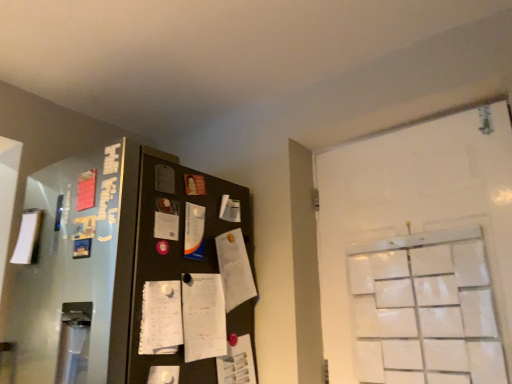
Question: From the image's perspective, is white matte paper at left, positioned as the third paper in right-to-left order, over white matte door at right?

Choices:
 (A) no
 (B) yes

Answer: (B)

Question: Could you tell me if white matte paper at left, the 2th paper when ordered from top to bottom, is facing white matte door at right?

Choices:
 (A) yes
 (B) no

Answer: (B)

Question: From the image's perspective, is white matte paper at left, positioned as the third paper in right-to-left order, under white matte door at right?

Choices:
 (A) yes
 (B) no

Answer: (B)

Question: Is white matte paper at left, placed as the 2th paper when sorted from bottom to top, outside of white matte door at right?

Choices:
 (A) yes
 (B) no

Answer: (A)

Question: Is white matte paper at left, the 2th paper when ordered from top to bottom, shorter than white matte door at right?

Choices:
 (A) no
 (B) yes

Answer: (B)

Question: Considering the positions of white paper notepad at center and white matte door at right in the image, is white paper notepad at center wider or thinner than white matte door at right?

Choices:
 (A) thin
 (B) wide

Answer: (A)

Question: Is white paper notepad at center situated inside white matte door at right or outside?

Choices:
 (A) outside
 (B) inside

Answer: (A)

Question: Is white paper notepad at center taller or shorter than white matte door at right?

Choices:
 (A) short
 (B) tall

Answer: (A)

Question: From a real-world perspective, is white paper notepad at center physically located above or below white matte door at right?

Choices:
 (A) below
 (B) above

Answer: (A)

Question: In the image, is white glossy paper at center, which is the third paper in bottom-to-top order, positioned in front of or behind white paper notepad at center?

Choices:
 (A) front
 (B) behind

Answer: (B)

Question: Is point (197, 256) positioned closer to the camera than point (193, 284)?

Choices:
 (A) farther
 (B) closer

Answer: (A)

Question: Visually, is white glossy paper at center, the second paper when ordered from right to left, positioned to the left or to the right of white paper notepad at center?

Choices:
 (A) right
 (B) left

Answer: (B)

Question: Which is correct: white glossy paper at center, the second paper when ordered from right to left, is inside white paper notepad at center, or outside of it?

Choices:
 (A) outside
 (B) inside

Answer: (A)

Question: In terms of width, does white matte door at right look wider or thinner when compared to white glossy paper at center, the second paper viewed from the left?

Choices:
 (A) thin
 (B) wide

Answer: (B)

Question: From the image's perspective, relative to white glossy paper at center, which is the third paper in bottom-to-top order, is white matte door at right above or below?

Choices:
 (A) above
 (B) below

Answer: (B)